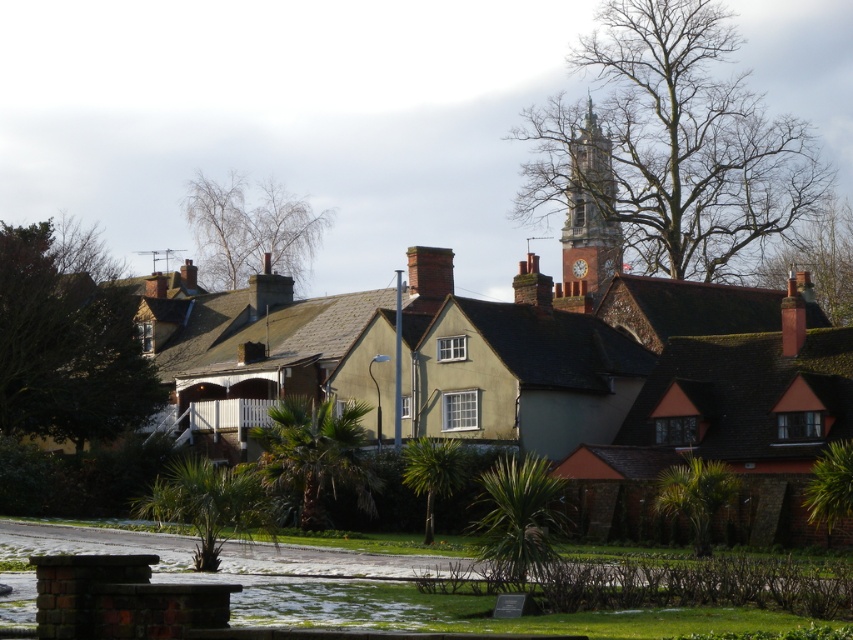
You are a drone operator planning to fly a drone from the brick clock tower at upper center to the brown brick chimney at center. Which direction should you fly the drone to reach the chimney?

The brick clock tower at upper center is positioned over the brown brick chimney at center, so you should fly the drone downward to reach the chimney.

You are a tourist in this residential area and want to take a photo of both the brick clock tower at upper center and the brown brick chimney at center. Which object should you focus on first to ensure both are in the frame?

You should focus on the brick clock tower at upper center first because it is larger in size than the brown brick chimney at center, so it will take up more space in the photo and ensure both are visible.